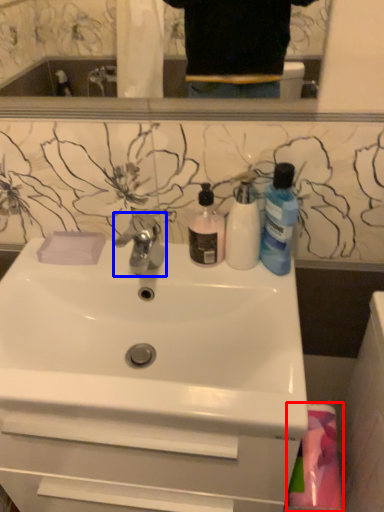
Question: Among these objects, which one is farthest to the camera, material (highlighted by a red box) or tap (highlighted by a blue box)?

Choices:
 (A) material
 (B) tap

Answer: (B)